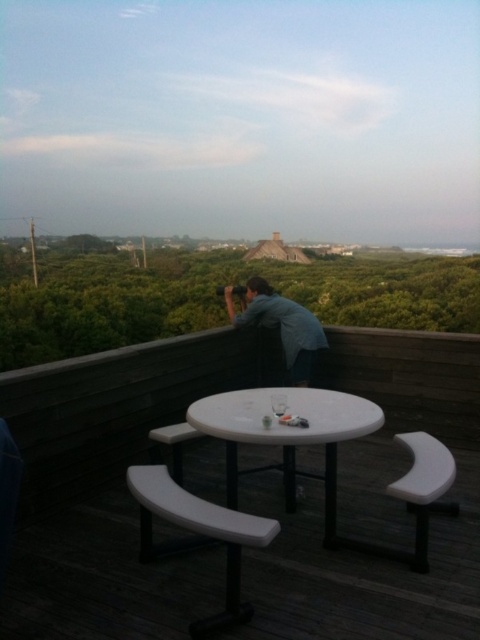
You are standing on the wooden deck and want to place a new decorative item on the white plastic picnic table at center. However, there is already a blue denim shirt at upper center. Based on their positions, can you place the new item on the picnic table without moving the shirt?

The white plastic picnic table at center is below the blue denim shirt at upper center, so the shirt is positioned above the table. Since the shirt is not on the table itself, you can place the new item on the picnic table at center without moving the shirt.

Based on the photo, you are standing on the wooden deck and want to place a blue denim shirt at upper center on the white plastic picnic table at center. Can you directly place it there without moving any existing items on the table?

The white plastic picnic table at center is to the left of the blue denim shirt at upper center, so you would need to move the shirt to the table since they are not in the same location.

Looking at this image, you are standing on the wooden deck and want to place a small potted plant on the white plastic picnic table at center. However, there is a blue denim shirt at upper center hanging nearby. Which object is shorter, allowing the plant to fit better?

The white plastic picnic table at center is not as tall as the blue denim shirt at upper center, so the plant should be placed on the picnic table since it is shorter.